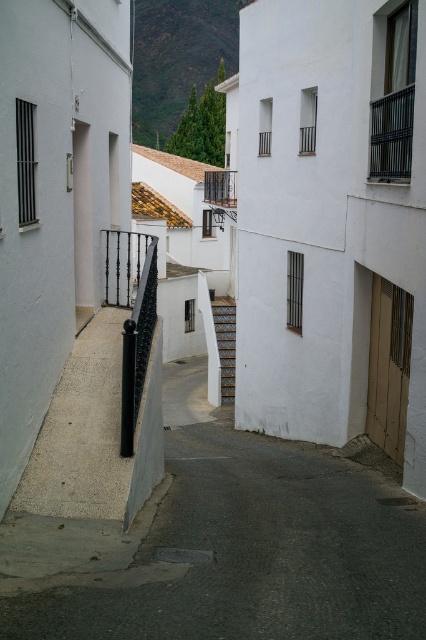
Question: Which object is farther from the camera taking this photo?

Choices:
 (A) wooden staircase at center
 (B) black metal balustrade at center

Answer: (B)

Question: Which of the following is the closest to the observer?

Choices:
 (A) black metal balustrade at center
 (B) wooden staircase at center

Answer: (B)

Question: Can you confirm if wooden staircase at center is smaller than black metal balustrade at center?

Choices:
 (A) no
 (B) yes

Answer: (A)

Question: Does wooden staircase at center lie in front of black metal balustrade at center?

Choices:
 (A) yes
 (B) no

Answer: (A)

Question: Can you confirm if wooden staircase at center is positioned to the left of black metal balustrade at center?

Choices:
 (A) yes
 (B) no

Answer: (A)